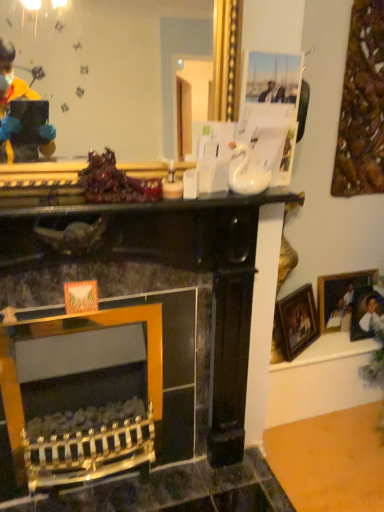
Question: Is gold metallic mirror at upper center outside gold-framed picture at right, the first picture frame when ordered from left to right?

Choices:
 (A) no
 (B) yes

Answer: (B)

Question: Is gold metallic mirror at upper center taller than gold-framed picture at right, which is the second picture frame from right to left?

Choices:
 (A) yes
 (B) no

Answer: (A)

Question: Are gold metallic mirror at upper center and gold-framed picture at right, which is the second picture frame from right to left, far apart?

Choices:
 (A) yes
 (B) no

Answer: (A)

Question: Can you confirm if gold metallic mirror at upper center is smaller than gold-framed picture at right, the first picture frame when ordered from left to right?

Choices:
 (A) yes
 (B) no

Answer: (B)

Question: From the image's perspective, is gold metallic mirror at upper center located beneath gold-framed picture at right, the first picture frame when ordered from left to right?

Choices:
 (A) yes
 (B) no

Answer: (B)

Question: In terms of height, does shiny purple grapes at center look taller or shorter compared to gold-framed picture at right, the first picture frame when ordered from left to right?

Choices:
 (A) tall
 (B) short

Answer: (B)

Question: From a real-world perspective, relative to gold-framed picture at right, the first picture frame when ordered from left to right, is shiny purple grapes at center vertically above or below?

Choices:
 (A) above
 (B) below

Answer: (A)

Question: Relative to gold-framed picture at right, the first picture frame when ordered from left to right, is shiny purple grapes at center in front or behind?

Choices:
 (A) front
 (B) behind

Answer: (A)

Question: Is shiny purple grapes at center wider or thinner than gold-framed picture at right, which is the second picture frame from right to left?

Choices:
 (A) thin
 (B) wide

Answer: (B)

Question: Considering the positions of point (119, 181) and point (324, 307), is point (119, 181) closer or farther from the camera than point (324, 307)?

Choices:
 (A) closer
 (B) farther

Answer: (A)

Question: Is shiny purple grapes at center in front of or behind wooden picture frame at right, which is the 2th picture frame in left-to-right order, in the image?

Choices:
 (A) behind
 (B) front

Answer: (B)

Question: From a real-world perspective, is shiny purple grapes at center physically located above or below wooden picture frame at right, which is the 2th picture frame in left-to-right order?

Choices:
 (A) below
 (B) above

Answer: (B)

Question: In terms of width, does shiny purple grapes at center look wider or thinner when compared to wooden picture frame at right, which is the 2th picture frame in left-to-right order?

Choices:
 (A) wide
 (B) thin

Answer: (A)

Question: From a real-world perspective, is shiny purple grapes at center positioned above or below gold metallic mirror at upper center?

Choices:
 (A) below
 (B) above

Answer: (A)

Question: Considering the positions of shiny purple grapes at center and gold metallic mirror at upper center in the image, is shiny purple grapes at center wider or thinner than gold metallic mirror at upper center?

Choices:
 (A) wide
 (B) thin

Answer: (A)